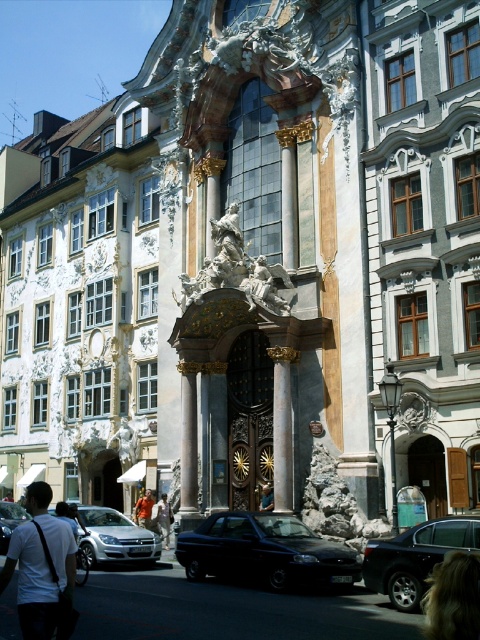
Question: Among these objects, which one is farthest from the camera?

Choices:
 (A) orange fabric shirt at center
 (B) light brown leather jacket at lower left
 (C) white marble column at center
 (D) black metallic car at lower center

Answer: (B)

Question: Based on their relative distances, which object is nearer to the black matte car at center?

Choices:
 (A) light brown leather jacket at lower left
 (B) light brown leather jacket at center

Answer: (B)

Question: Which object is closer to the camera taking this photo?

Choices:
 (A) dark blue jeans at center
 (B) light brown leather jacket at lower left
 (C) matte gold statue at center
 (D) orange fabric shirt at center

Answer: (A)

Question: Is white fabric shirt at lower left smaller than satin silver sedan at center?

Choices:
 (A) no
 (B) yes

Answer: (A)

Question: Is matte stone statue at center thinner than light brown leather jacket at lower left?

Choices:
 (A) yes
 (B) no

Answer: (A)

Question: Does white marble column at center have a larger size compared to light brown wooden door at center?

Choices:
 (A) no
 (B) yes

Answer: (B)